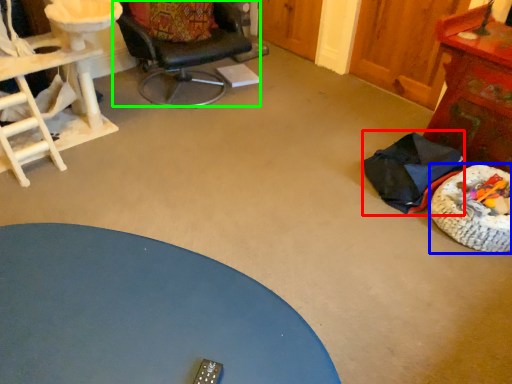
Question: Estimate the real-world distances between objects in this image. Which object is farther from chair (highlighted by a red box), dog bed (highlighted by a blue box) or chair (highlighted by a green box)?

Choices:
 (A) dog bed
 (B) chair

Answer: (B)